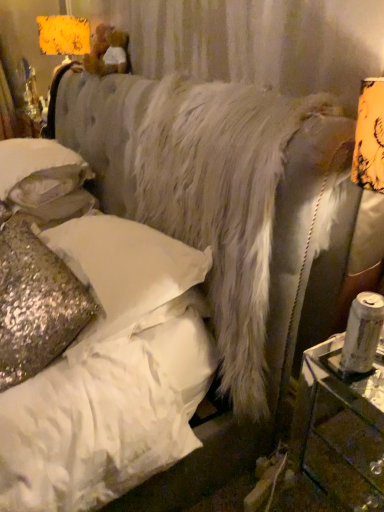
Question: Considering the positions of clear glass table at right and sparkly gold pillow at lower left, marked as the 1th pillow in a bottom-to-top arrangement, in the image, is clear glass table at right bigger or smaller than sparkly gold pillow at lower left, marked as the 1th pillow in a bottom-to-top arrangement,?

Choices:
 (A) small
 (B) big

Answer: (A)

Question: From the image's perspective, is clear glass table at right located above or below sparkly gold pillow at lower left, marked as the 1th pillow in a bottom-to-top arrangement?

Choices:
 (A) above
 (B) below

Answer: (B)

Question: Which of these objects is positioned farthest from the sparkly gold pillow at lower left, marked as the 1th pillow in a bottom-to-top arrangement?

Choices:
 (A) clear glass table at right
 (B) white sequined pillow at upper left, which appears as the 3th pillow when ordered from the bottom
 (C) glittery sequined pillow at lower left, which is the 2th pillow from bottom to top

Answer: (A)

Question: Estimate the real-world distances between objects in this image. Which object is farther from the white sequined pillow at upper left, which appears as the 3th pillow when ordered from the bottom?

Choices:
 (A) clear glass table at right
 (B) sparkly gold pillow at lower left, marked as the 1th pillow in a bottom-to-top arrangement
 (C) glittery sequined pillow at lower left, which is the 2th pillow from bottom to top

Answer: (A)